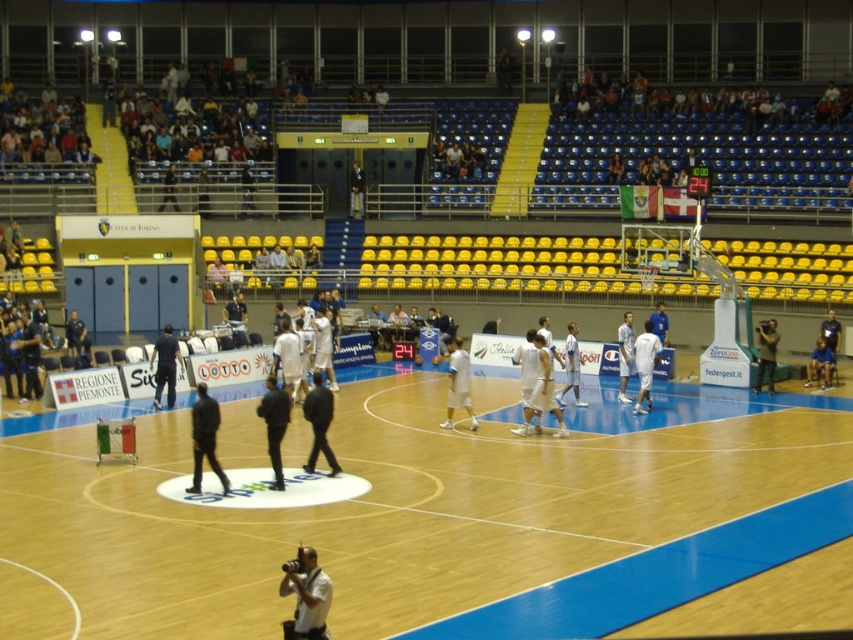
You are standing at the center of the basketball court and want to place a small basketball equipment bag at the wooden at center. Can you confirm the exact coordinates where you should place it?

The wooden at center is located at coordinates point (425, 518), so place the equipment bag there.

You are a photographer standing at the edge of the basketball court. You want to take a photo of both the dark blue jacket at center and the dark gray jacket at center. Which jacket should you focus on first if you want to capture both in the same frame without moving your camera?

The dark blue jacket at center is positioned under the dark gray jacket at center, so you should focus on the dark gray jacket at center first to ensure both are in focus since it is closer to the camera.

You are a photographer standing at the edge of the basketball court. You want to take a photo of the wooden at center while ensuring the white matte camera at lower center is also in the frame. Given their relative heights, will the camera be visible in the photo?

The wooden at center is taller than the white matte camera at lower center, so if the photographer positions themselves to include both in the frame, the camera will be visible as it is shorter and located at lower center.